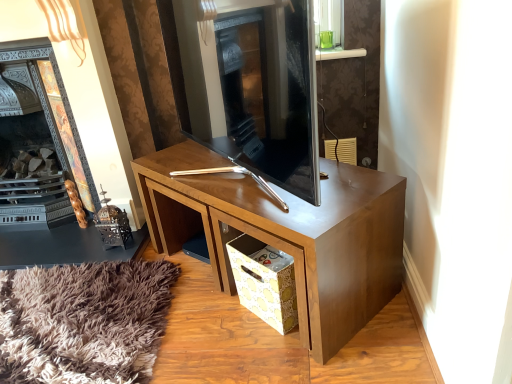
Question: Does dark wood fireplace at left, which is the 1th fireplace in left-to-right order, have a greater height compared to yellow paper bag at lower center?

Choices:
 (A) no
 (B) yes

Answer: (B)

Question: Is dark wood fireplace at left, which is the 1th fireplace in left-to-right order, in contact with yellow paper bag at lower center?

Choices:
 (A) no
 (B) yes

Answer: (A)

Question: Considering the relative positions of dark wood fireplace at left, which is the 1th fireplace in left-to-right order, and yellow paper bag at lower center in the image provided, is dark wood fireplace at left, which is the 1th fireplace in left-to-right order, behind yellow paper bag at lower center?

Choices:
 (A) yes
 (B) no

Answer: (A)

Question: From the image's perspective, does dark wood fireplace at left, which is the 1th fireplace in left-to-right order, appear higher than yellow paper bag at lower center?

Choices:
 (A) no
 (B) yes

Answer: (B)

Question: From the image's perspective, is dark wood fireplace at left, arranged as the 2th fireplace when viewed from the right, under yellow paper bag at lower center?

Choices:
 (A) no
 (B) yes

Answer: (A)

Question: Relative to wooden desk at center, is yellow paper bag at lower center in front or behind?

Choices:
 (A) front
 (B) behind

Answer: (B)

Question: Considering the positions of yellow paper bag at lower center and wooden desk at center in the image, is yellow paper bag at lower center wider or thinner than wooden desk at center?

Choices:
 (A) thin
 (B) wide

Answer: (A)

Question: From a real-world perspective, is yellow paper bag at lower center physically located above or below wooden desk at center?

Choices:
 (A) below
 (B) above

Answer: (A)

Question: Looking at the image, does yellow paper bag at lower center seem bigger or smaller compared to wooden desk at center?

Choices:
 (A) small
 (B) big

Answer: (A)

Question: From the image's perspective, is dark gray stone fireplace at center, which ranks as the first fireplace in right-to-left order, located above or below yellow paper bag at lower center?

Choices:
 (A) above
 (B) below

Answer: (A)

Question: Considering the positions of dark gray stone fireplace at center, which ranks as the 2th fireplace in left-to-right order, and yellow paper bag at lower center in the image, is dark gray stone fireplace at center, which ranks as the 2th fireplace in left-to-right order, wider or thinner than yellow paper bag at lower center?

Choices:
 (A) thin
 (B) wide

Answer: (B)

Question: Considering the positions of dark gray stone fireplace at center, which ranks as the 2th fireplace in left-to-right order, and yellow paper bag at lower center in the image, is dark gray stone fireplace at center, which ranks as the 2th fireplace in left-to-right order, taller or shorter than yellow paper bag at lower center?

Choices:
 (A) short
 (B) tall

Answer: (B)

Question: Is dark gray stone fireplace at center, which ranks as the first fireplace in right-to-left order, bigger or smaller than yellow paper bag at lower center?

Choices:
 (A) small
 (B) big

Answer: (B)

Question: Does point (310, 190) appear closer or farther from the camera than point (330, 221)?

Choices:
 (A) farther
 (B) closer

Answer: (B)

Question: Considering the relative positions of dark gray stone fireplace at center, which ranks as the 2th fireplace in left-to-right order, and wooden desk at center in the image provided, is dark gray stone fireplace at center, which ranks as the 2th fireplace in left-to-right order, to the left or to the right of wooden desk at center?

Choices:
 (A) left
 (B) right

Answer: (A)